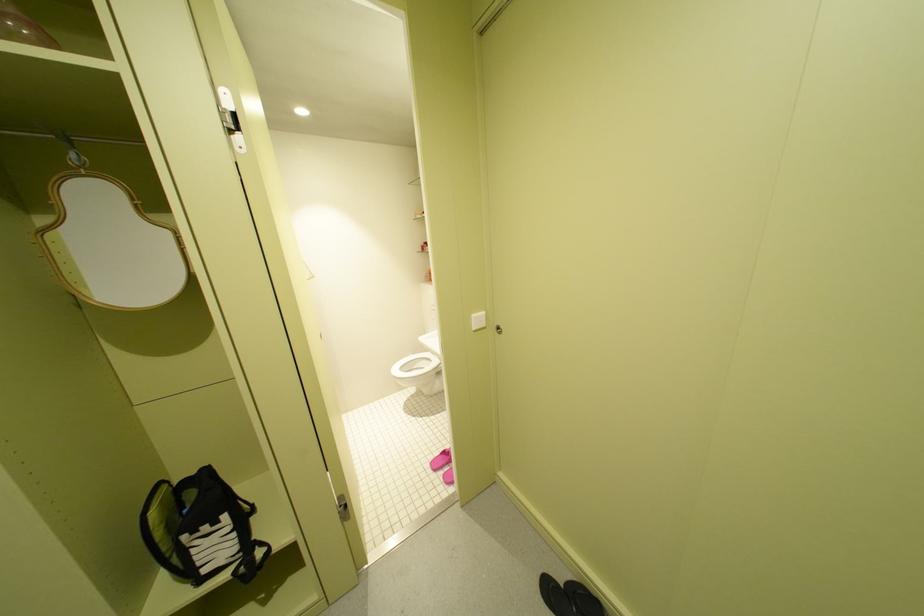
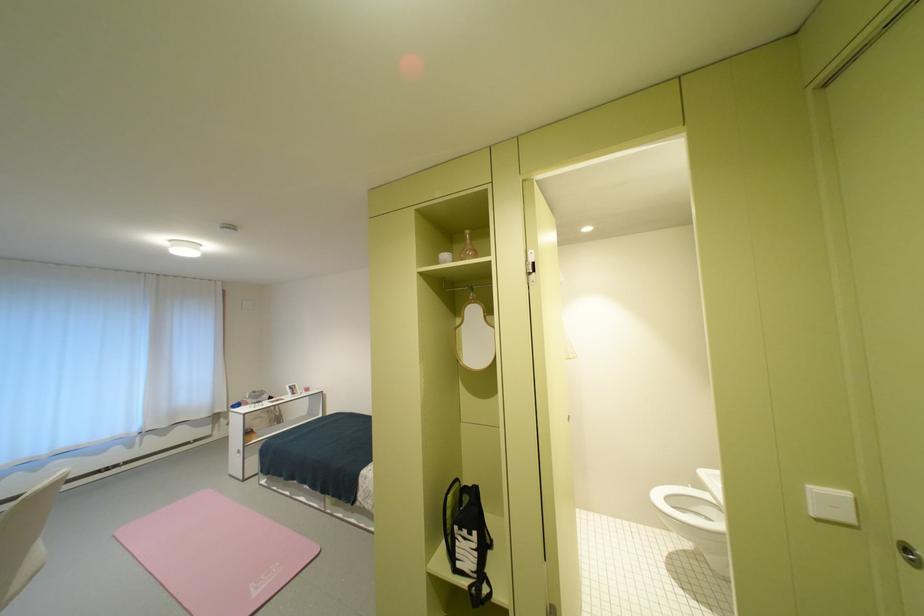
Where in the second image is the point corresponding to (52,222) from the first image?

(468, 322)